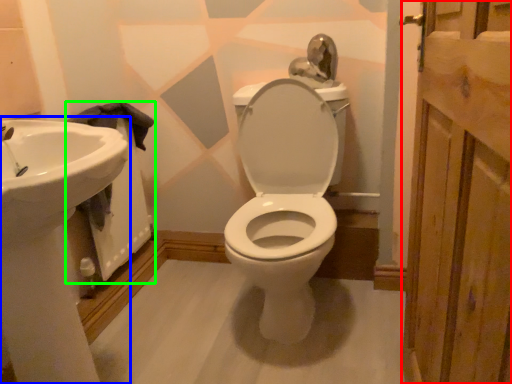
Question: Which object is positioned farthest from screen door (highlighted by a red box)? Select from sink (highlighted by a blue box) and bath (highlighted by a green box).

Choices:
 (A) sink
 (B) bath

Answer: (B)